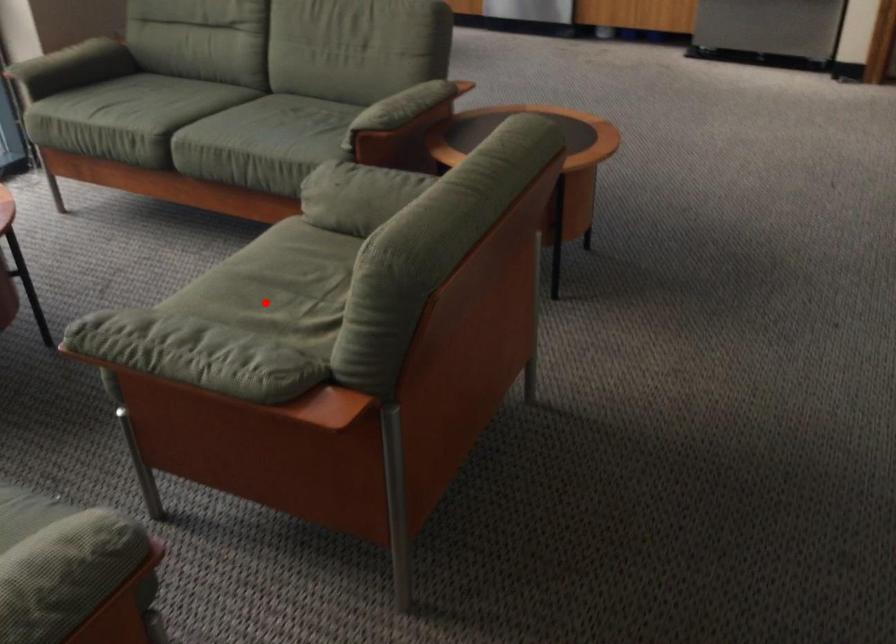
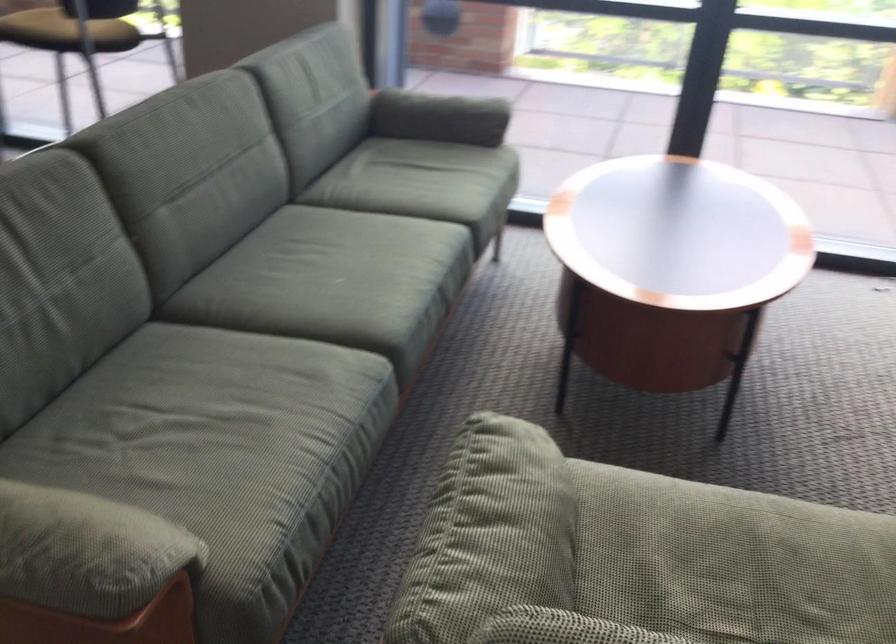
Where in the second image is the point corresponding to the highlighted location from the first image?

(702, 582)